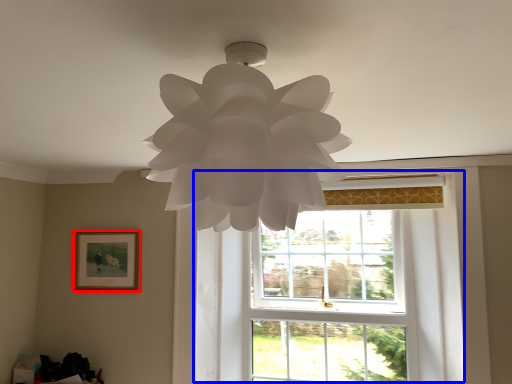
Question: Which object is further to the camera taking this photo, picture frame (highlighted by a red box) or window (highlighted by a blue box)?

Choices:
 (A) picture frame
 (B) window

Answer: (A)